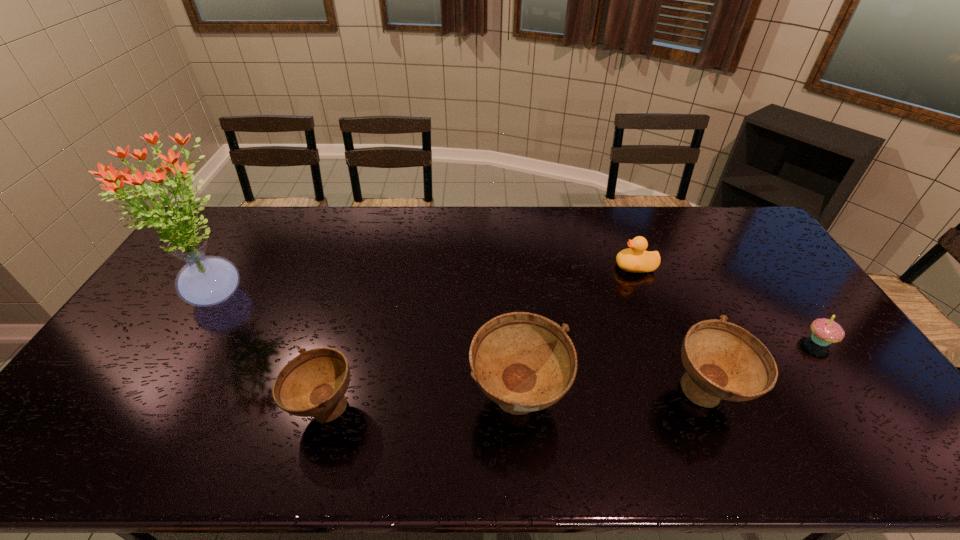
At what (x,y) coordinates should I click in order to perform the action: click on vacant space in between the rightmost object and the duck. Please return your answer as a coordinate pair (x, y). Looking at the image, I should click on (728, 303).

The height and width of the screenshot is (540, 960). In order to click on the third closest object to the cupcake in this screenshot , I will do `click(524, 362)`.

Select which object is the second closest to the rightmost soup bowl. Please provide its 2D coordinates. Your answer should be formatted as a tuple, i.e. [(x, y)], where the tuple contains the x and y coordinates of a point satisfying the conditions above.

[(524, 362)]

Locate an element on the screen. The height and width of the screenshot is (540, 960). the closest soup bowl to the rightmost object is located at coordinates (722, 360).

Where is `soup bowl that stands as the closest to the flower arrangement`? soup bowl that stands as the closest to the flower arrangement is located at coordinates (314, 383).

The height and width of the screenshot is (540, 960). I want to click on vacant space that satisfies the following two spatial constraints: 1. on the back side of the third shortest object; 2. on the left side of the second soup bowl from right to left, so click(326, 402).

Where is `vacant position in the image that satisfies the following two spatial constraints: 1. on the face of the cupcake; 2. on the left side of the duck`? The height and width of the screenshot is (540, 960). vacant position in the image that satisfies the following two spatial constraints: 1. on the face of the cupcake; 2. on the left side of the duck is located at coordinates (663, 340).

Locate an element on the screen. The height and width of the screenshot is (540, 960). free space in the image that satisfies the following two spatial constraints: 1. on the face of the fourth shortest object; 2. on the right side of the duck is located at coordinates (684, 394).